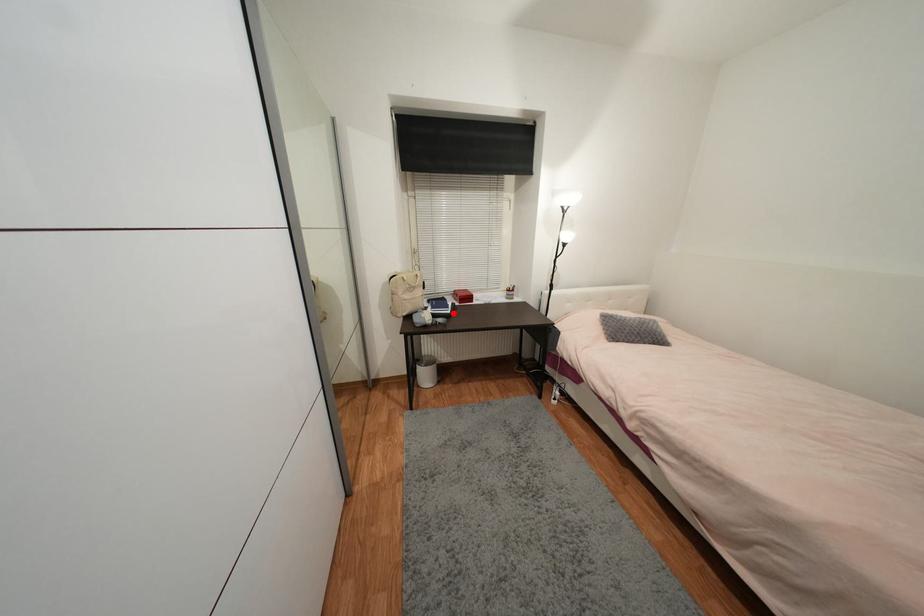
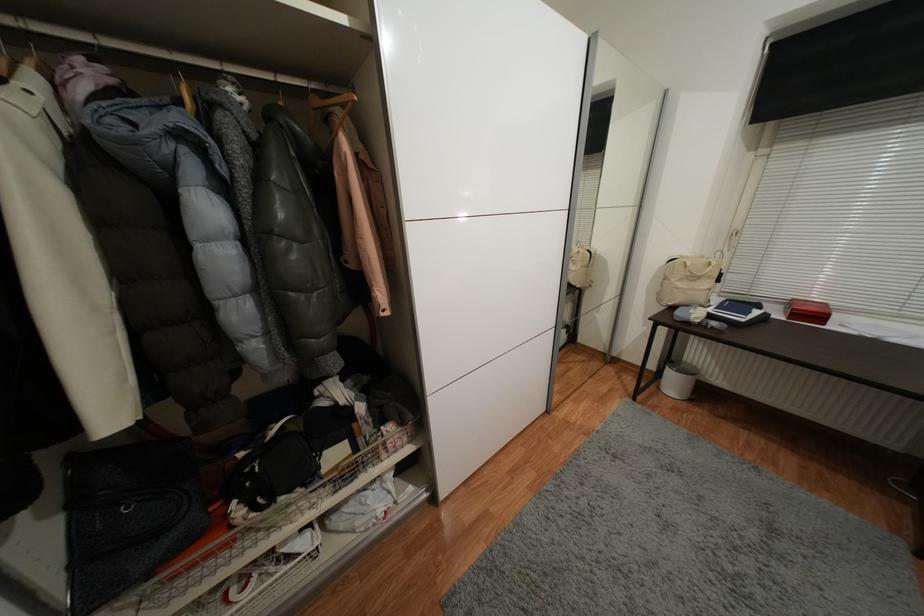
Find the pixel in the second image that matches the highlighted location in the first image.

(747, 321)